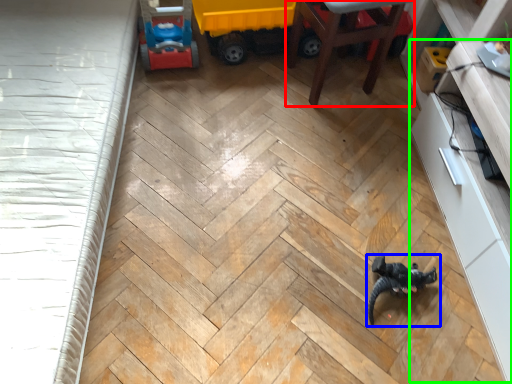
Question: Which is farther away from furniture (highlighted by a red box)? toy (highlighted by a blue box) or dresser (highlighted by a green box)?

Choices:
 (A) toy
 (B) dresser

Answer: (A)